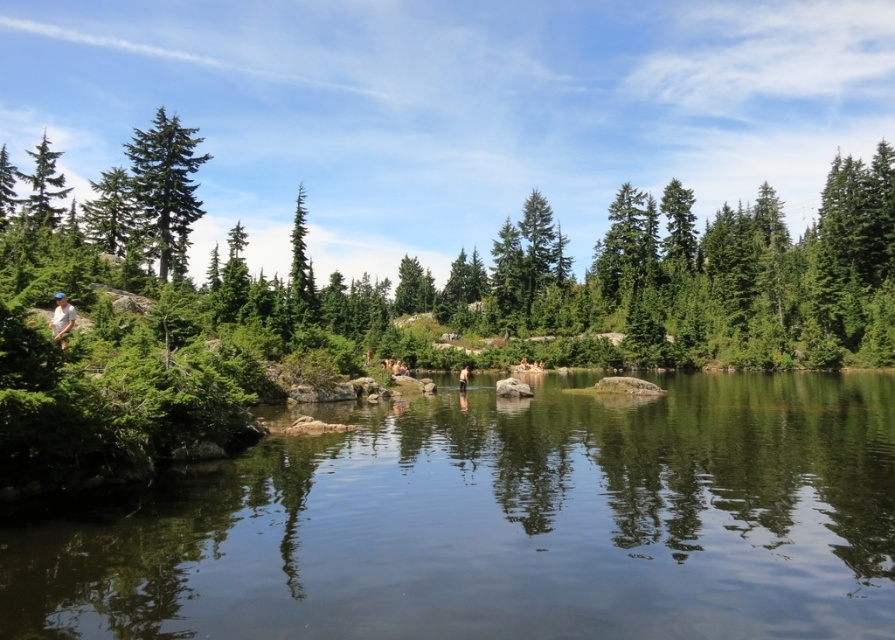
Can you confirm if green matte tree at upper left is positioned below green matte tree at left?

Yes.

Measure the distance between green matte tree at upper left and camera.

green matte tree at upper left and camera are 237.03 feet apart.

The height and width of the screenshot is (640, 895). What are the coordinates of `green matte tree at upper left` in the screenshot? It's located at (166, 188).

Based on the photo, is clear water at center above green matte tree at left?

No.

Identify the location of clear water at center. (504, 522).

You are a GUI agent. You are given a task and a screenshot of the screen. Output one action in this format:
    pyautogui.click(x=<x>, y=<y>)
    Task: Click on the clear water at center
    
    Given the screenshot: What is the action you would take?
    pyautogui.click(x=504, y=522)

How distant is white cotton shirt at left from skinny jeans at center?

38.72 meters

Is white cotton shirt at left shorter than skinny jeans at center?

Yes.

Between point (65, 308) and point (459, 369), which one is positioned in front?

Point (65, 308) is in front.

This screenshot has height=640, width=895. In order to click on white cotton shirt at left in this screenshot , I will do `click(62, 317)`.